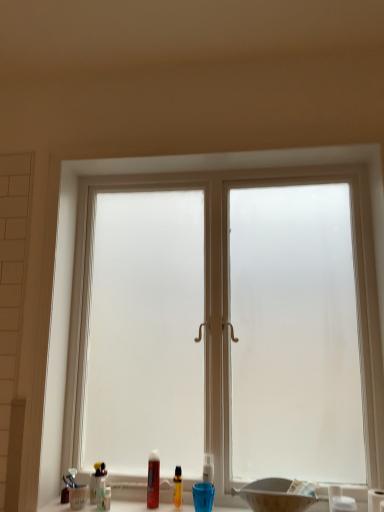
The height and width of the screenshot is (512, 384). In order to click on vacant region to the left of translucent plastic toothbrush at lower center, marked as the 4th toiletry in a right-to-left arrangement in this screenshot , I will do `click(71, 500)`.